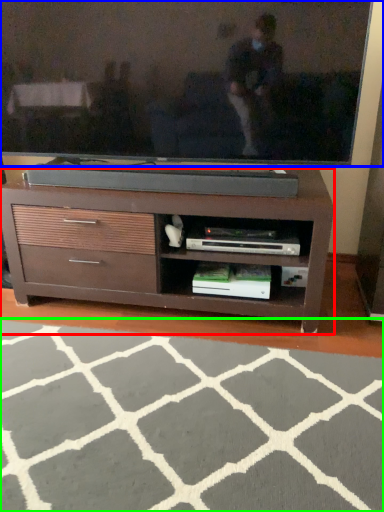
Question: Considering the real-world distances, which object is farthest from chest of drawers (highlighted by a red box)? television (highlighted by a blue box) or plain (highlighted by a green box)?

Choices:
 (A) television
 (B) plain

Answer: (B)